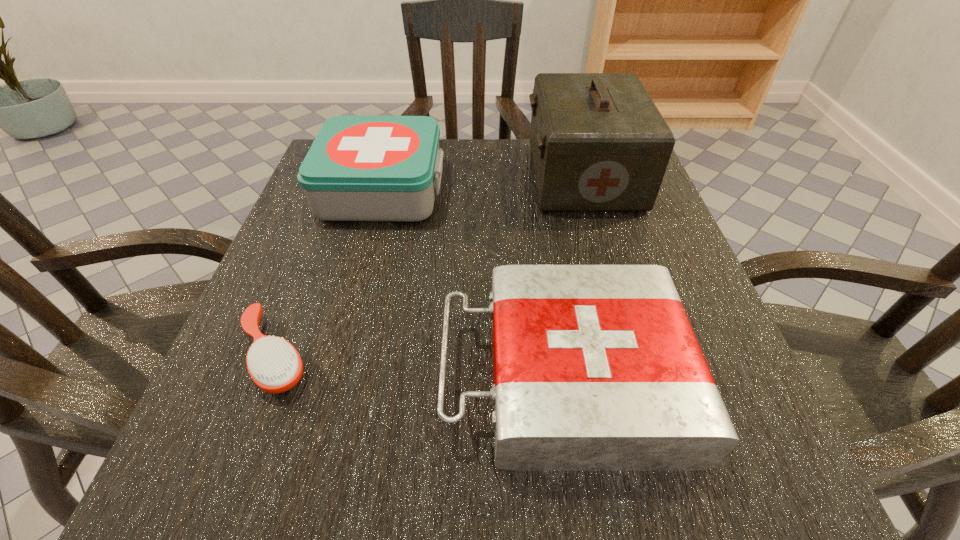
Image resolution: width=960 pixels, height=540 pixels. In order to click on vacant space situated on the back of the shortest object in this screenshot , I will do `click(319, 241)`.

This screenshot has width=960, height=540. What are the coordinates of `object that is at the near edge` in the screenshot? It's located at (595, 367).

You are a GUI agent. You are given a task and a screenshot of the screen. Output one action in this format:
    pyautogui.click(x=<x>, y=<y>)
    Task: Click on the first-aid kit that is at the left edge
    
    Given the screenshot: What is the action you would take?
    (x=359, y=168)

Identify the location of hairbrush that is at the left edge. (275, 366).

The image size is (960, 540). I want to click on object located in the far left corner section of the desktop, so click(x=359, y=168).

Where is `object that is at the far right corner`? object that is at the far right corner is located at coordinates (599, 143).

Identify the location of object that is at the near right corner. (595, 367).

Locate an element on the screen. This screenshot has width=960, height=540. vacant space at the far edge is located at coordinates (474, 153).

Locate an element on the screen. Image resolution: width=960 pixels, height=540 pixels. free space at the near edge of the desktop is located at coordinates (431, 470).

Locate an element on the screen. Image resolution: width=960 pixels, height=540 pixels. vacant space at the left edge is located at coordinates (288, 265).